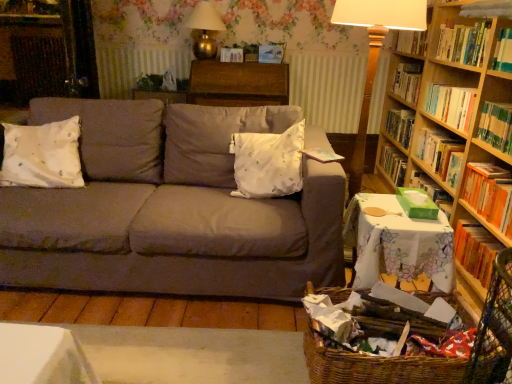
This screenshot has width=512, height=384. I want to click on vacant area on top of white floral tablecloth at lower right, acting as the first table starting from the right (from a real-world perspective), so click(414, 214).